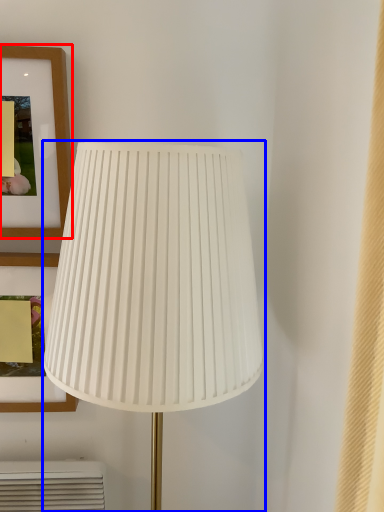
Question: Among these objects, which one is nearest to the camera, picture frame (highlighted by a red box) or lamp (highlighted by a blue box)?

Choices:
 (A) picture frame
 (B) lamp

Answer: (B)